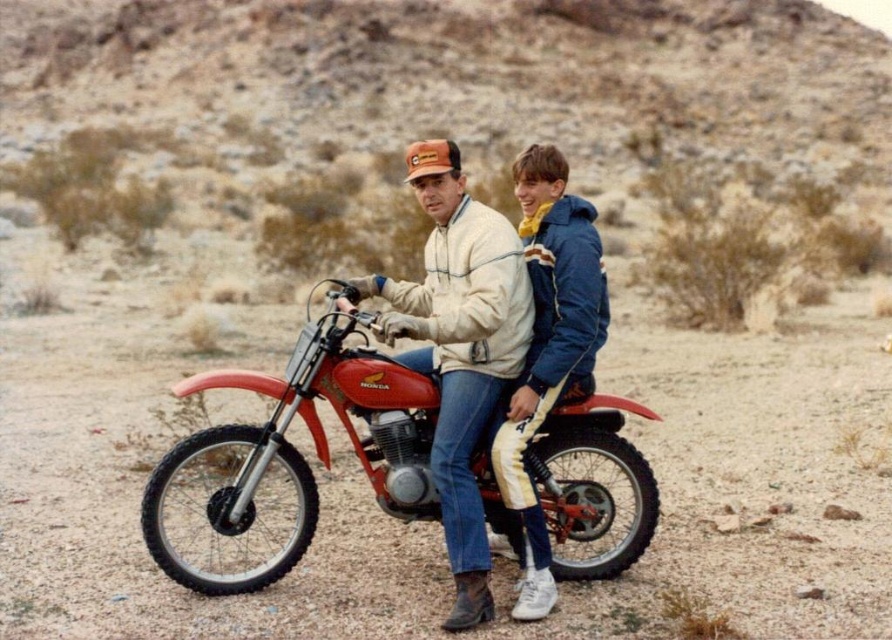
You are a photographer planning to take a photo of the white fleece jacket at center and the shiny red dirt bike at center. Based on their sizes in the image, which object should you focus on first if you want to ensure both are in focus without adjusting the camera settings?

The white fleece jacket at center is much taller than the shiny red dirt bike at center, so you should focus on the taller object first to ensure both are in focus.

You are a photographer trying to capture a clear shot of the white fleece jacket at center and the shiny red dirt bike at center. Since the jacket is above the dirt bike, how might you adjust your camera angle to ensure both are visible in the frame?

Since the white fleece jacket at center is above the shiny red dirt bike at center, you should lower your camera angle slightly to ensure both the jacket and the dirt bike are fully visible in the frame.